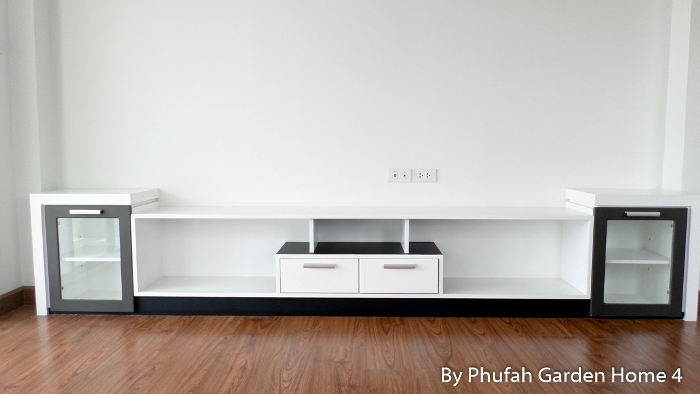
Image resolution: width=700 pixels, height=394 pixels. What are the coordinates of `handle` in the screenshot? It's located at (94, 207).